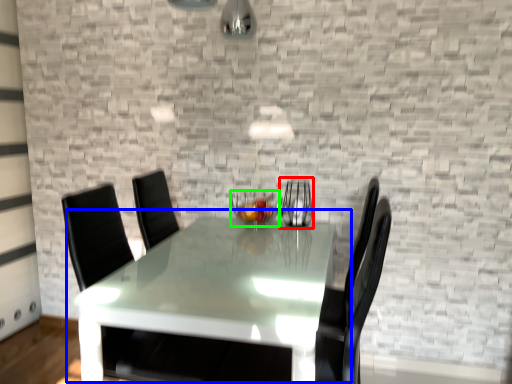
Question: Which is farther away from glass vase (highlighted by a red box)? table (highlighted by a blue box) or candle holder (highlighted by a green box)?

Choices:
 (A) table
 (B) candle holder

Answer: (A)